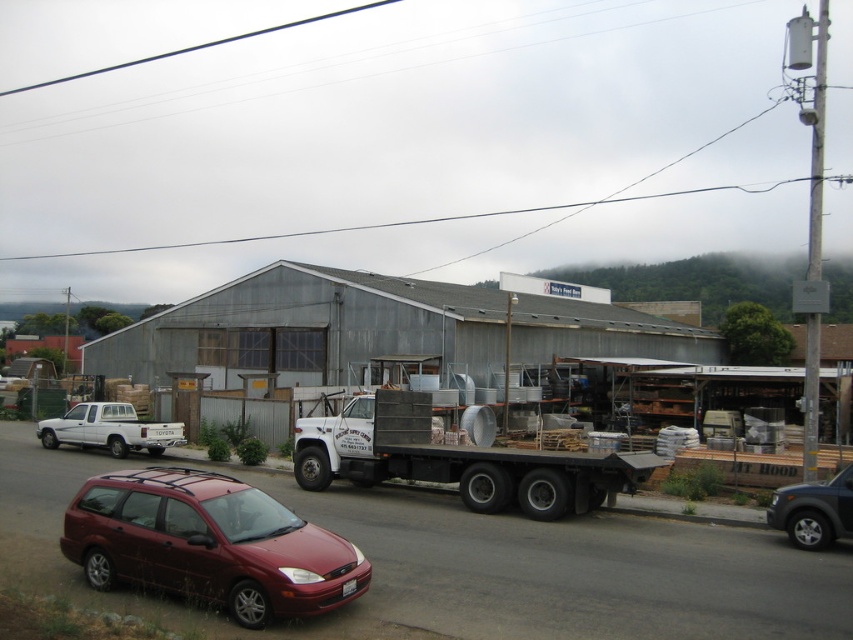
Question: Among these objects, which one is farthest from the camera?

Choices:
 (A) metallic flatbed truck at center
 (B) white matte truck at left
 (C) dark gray metallic suv at right

Answer: (B)

Question: Observing the image, what is the correct spatial positioning of metallic flatbed truck at center in reference to dark gray metallic suv at right?

Choices:
 (A) right
 (B) left

Answer: (B)

Question: Does metallic flatbed truck at center appear on the right side of white matte truck at left?

Choices:
 (A) no
 (B) yes

Answer: (B)

Question: Among these objects, which one is nearest to the camera?

Choices:
 (A) white matte truck at left
 (B) shiny red station wagon at lower left
 (C) dark gray metallic suv at right

Answer: (B)

Question: Is metallic flatbed truck at center positioned in front of dark gray metallic suv at right?

Choices:
 (A) no
 (B) yes

Answer: (A)

Question: Which point appears farthest from the camera in this image?

Choices:
 (A) (96, 438)
 (B) (103, 544)

Answer: (A)